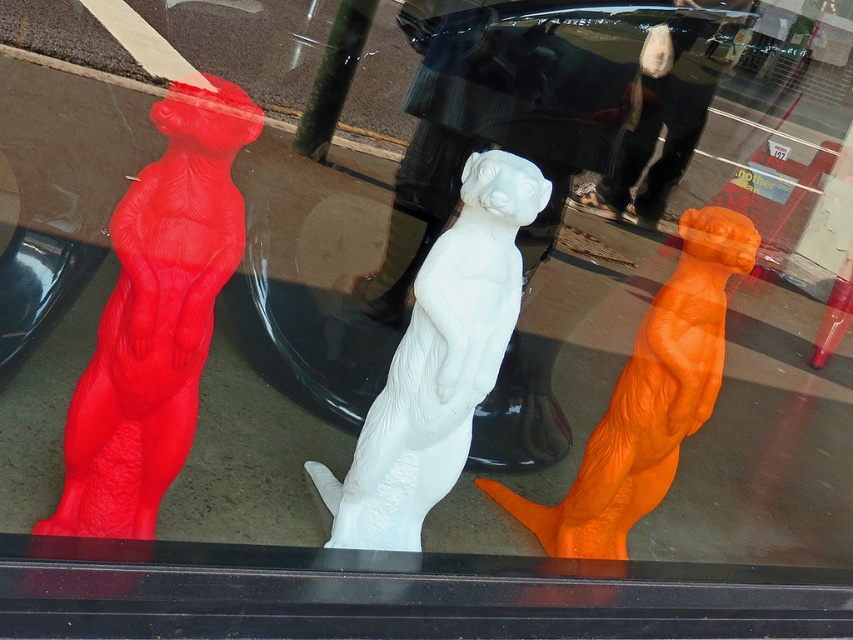
Does matte red statue at left have a greater height compared to white matte otter at center?

Indeed, matte red statue at left has a greater height compared to white matte otter at center.

Can you confirm if matte red statue at left is positioned to the left of white matte otter at center?

Correct, you'll find matte red statue at left to the left of white matte otter at center.

Measure the distance between point (78, 445) and camera.

1.52 meters

Where is `matte red statue at left`? The width and height of the screenshot is (853, 640). matte red statue at left is located at coordinates (155, 316).

Is matte red statue at left thinner than orange matte otter at center?

Yes, matte red statue at left is thinner than orange matte otter at center.

Is matte red statue at left bigger than orange matte otter at center?

No, matte red statue at left is not bigger than orange matte otter at center.

This screenshot has width=853, height=640. In order to click on matte red statue at left in this screenshot , I will do (155, 316).

Does point (426, 444) lie in front of point (683, 420)?

Yes, it is in front of point (683, 420).

Between white matte otter at center and orange matte otter at center, which one has less height?

orange matte otter at center

From the picture: Who is more distant from viewer, (x=323, y=484) or (x=520, y=508)?

The point (x=520, y=508) is behind.

I want to click on white matte otter at center, so click(x=438, y=362).